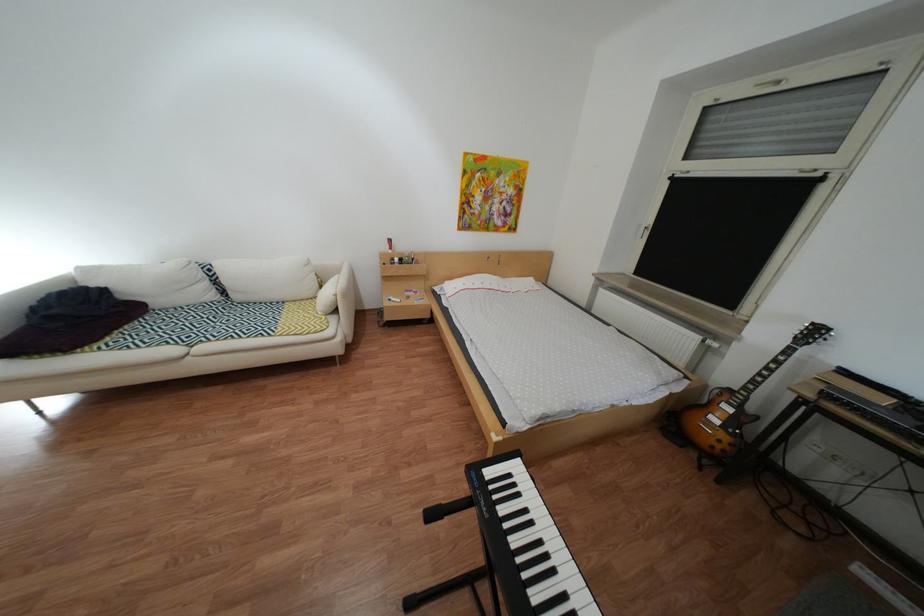
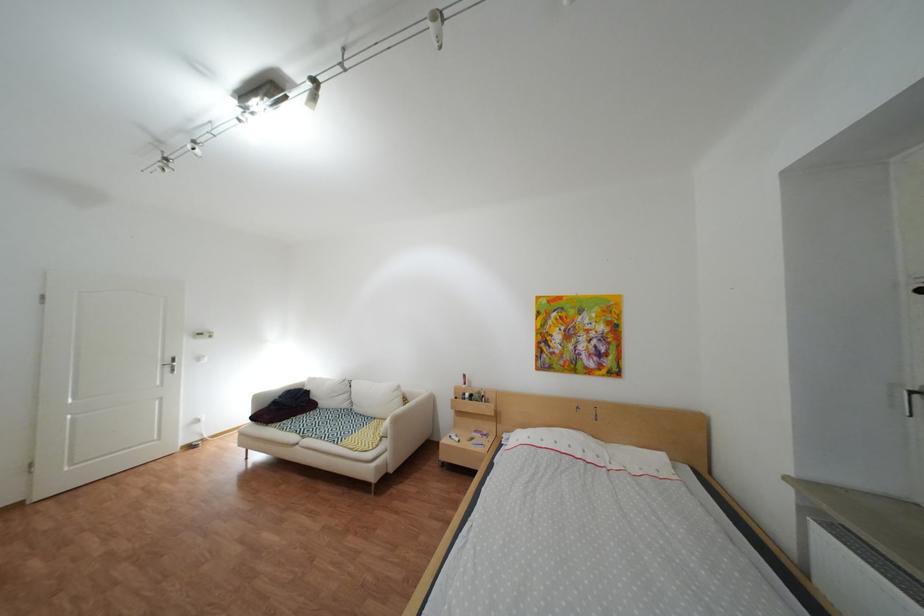
Find the pixel in the second image that matches the point at 408,261 in the first image.

(480, 395)